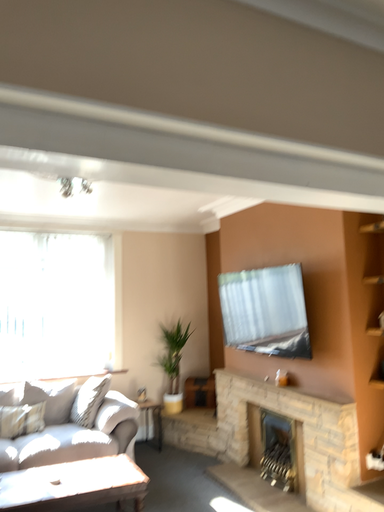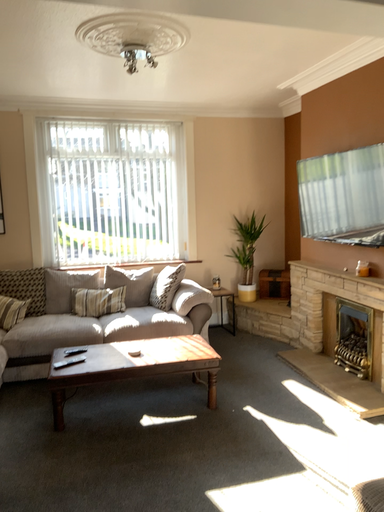
Question: Which way did the camera rotate in the video?

Choices:
 (A) rotated right
 (B) rotated left

Answer: (B)